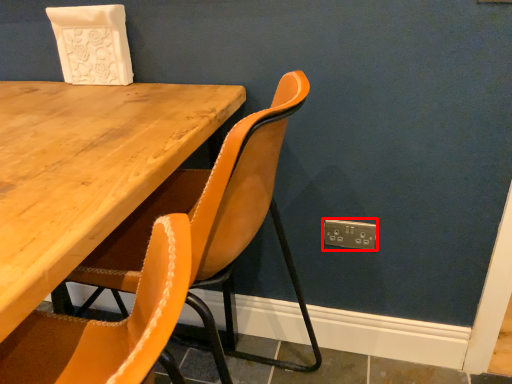
Question: Where is electric outlet (annotated by the red box) located in relation to chair in the image?

Choices:
 (A) left
 (B) right

Answer: (B)